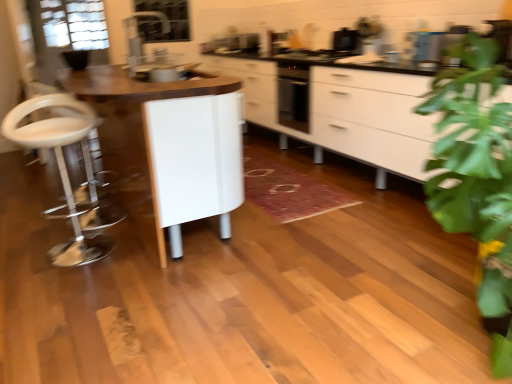
Question: Based on their sizes in the image, would you say clear glass window screen at upper center is bigger or smaller than white glossy table at center?

Choices:
 (A) small
 (B) big

Answer: (A)

Question: From a real-world perspective, is clear glass window screen at upper center physically located above or below white glossy table at center?

Choices:
 (A) above
 (B) below

Answer: (A)

Question: Based on their relative distances, which object is nearer to the white glossy cabinet at center?

Choices:
 (A) black glossy toaster at upper right
 (B) transparent glass door at upper left
 (C) white glossy swivel chair at left
 (D) clear glass window screen at upper center
 (E) white glossy table at center

Answer: (A)

Question: Which is nearer to the white glossy table at center?

Choices:
 (A) white glossy swivel chair at left
 (B) black glossy toaster at upper right
 (C) white glossy cabinet at center
 (D) transparent glass door at upper left
 (E) clear glass window screen at upper center

Answer: (A)